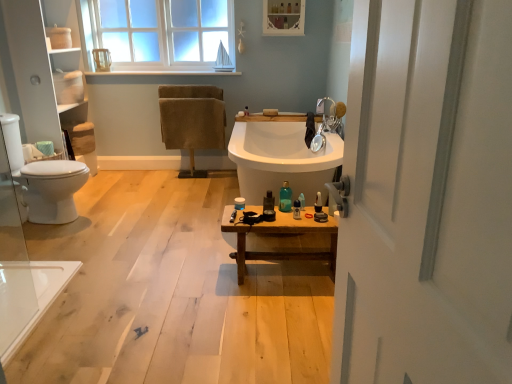
Image resolution: width=512 pixels, height=384 pixels. What are the coordinates of `vacant space in front of wooden bench at center` in the screenshot? It's located at (275, 316).